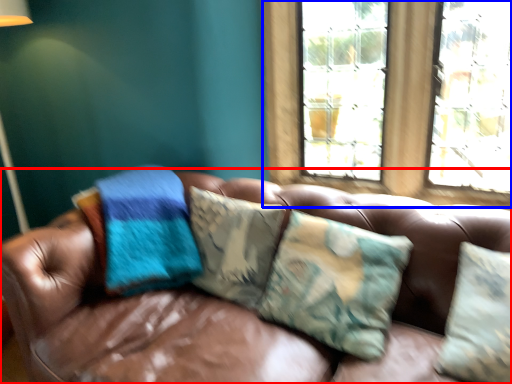
Question: Which of the following is the closest to the observer, studio couch (highlighted by a red box) or window (highlighted by a blue box)?

Choices:
 (A) studio couch
 (B) window

Answer: (A)